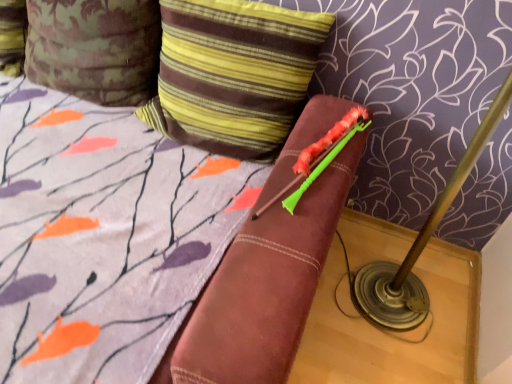
Question: Would you say camouflage fabric pillow at upper left, placed as the 1th pillow when sorted from left to right, is inside or outside striped fabric pillow at upper center, the 2th pillow viewed from the left?

Choices:
 (A) outside
 (B) inside

Answer: (A)

Question: Is camouflage fabric pillow at upper left, marked as the 2th pillow in a right-to-left arrangement, to the left or to the right of striped fabric pillow at upper center, the 2th pillow viewed from the left, in the image?

Choices:
 (A) left
 (B) right

Answer: (A)

Question: Is camouflage fabric pillow at upper left, marked as the 2th pillow in a right-to-left arrangement, in front of or behind striped fabric pillow at upper center, the 2th pillow viewed from the left, in the image?

Choices:
 (A) behind
 (B) front

Answer: (A)

Question: Is striped fabric pillow at upper center, the 2th pillow viewed from the left, taller or shorter than camouflage fabric pillow at upper left, placed as the 1th pillow when sorted from left to right?

Choices:
 (A) tall
 (B) short

Answer: (B)

Question: From the image's perspective, relative to camouflage fabric pillow at upper left, placed as the 1th pillow when sorted from left to right, is striped fabric pillow at upper center, the 2th pillow viewed from the left, above or below?

Choices:
 (A) above
 (B) below

Answer: (B)

Question: Considering the positions of striped fabric pillow at upper center, the 2th pillow viewed from the left, and camouflage fabric pillow at upper left, marked as the 2th pillow in a right-to-left arrangement, in the image, is striped fabric pillow at upper center, the 2th pillow viewed from the left, wider or thinner than camouflage fabric pillow at upper left, marked as the 2th pillow in a right-to-left arrangement,?

Choices:
 (A) wide
 (B) thin

Answer: (B)

Question: Considering the positions of striped fabric pillow at upper center, the first pillow in the right-to-left sequence, and camouflage fabric pillow at upper left, marked as the 2th pillow in a right-to-left arrangement, in the image, is striped fabric pillow at upper center, the first pillow in the right-to-left sequence, bigger or smaller than camouflage fabric pillow at upper left, marked as the 2th pillow in a right-to-left arrangement,?

Choices:
 (A) small
 (B) big

Answer: (B)